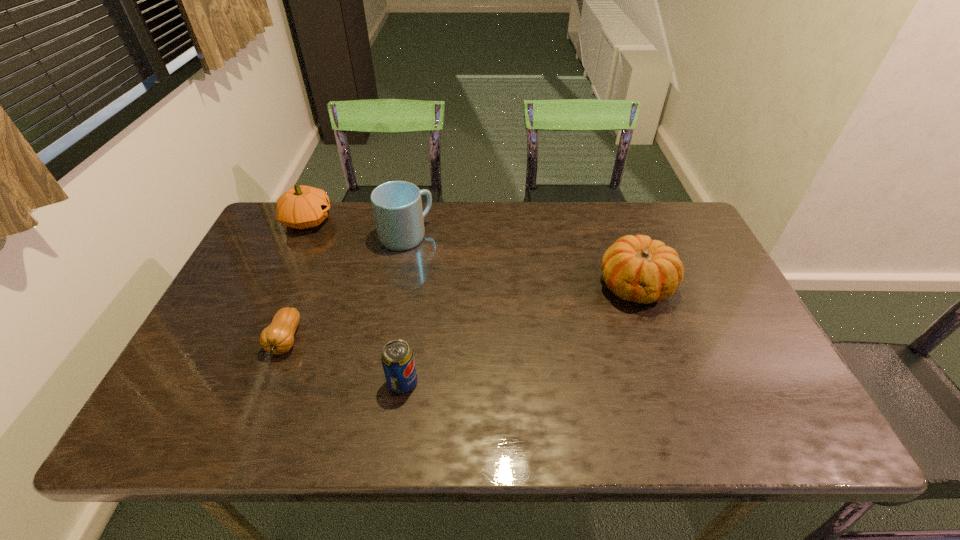
Where is `free space located 0.270m on the left of the nearest object`? free space located 0.270m on the left of the nearest object is located at coordinates (268, 382).

Find the location of `free space located 0.170m on the stem side of the shortest object`. free space located 0.170m on the stem side of the shortest object is located at coordinates (248, 435).

Locate an element on the screen. The height and width of the screenshot is (540, 960). mug at the far edge is located at coordinates (397, 206).

This screenshot has width=960, height=540. Identify the location of gourd located at the far edge. (301, 207).

Identify the location of object that is at the left edge. (301, 207).

This screenshot has width=960, height=540. In order to click on object located in the right edge section of the desktop in this screenshot , I will do `click(636, 268)`.

This screenshot has width=960, height=540. In order to click on object located in the far left corner section of the desktop in this screenshot , I will do `click(301, 207)`.

Locate an element on the screen. The image size is (960, 540). free space at the far edge of the desktop is located at coordinates (519, 232).

Locate an element on the screen. free location at the near edge is located at coordinates (707, 404).

Identify the location of vacant area at the left edge of the desktop. (264, 269).